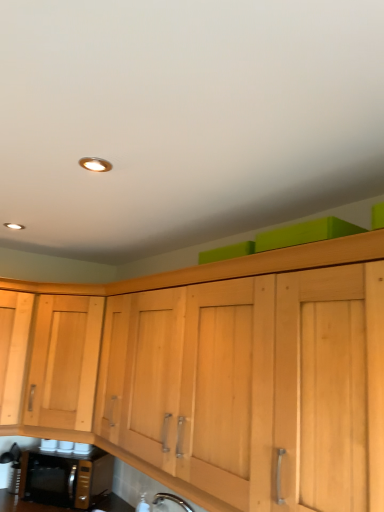
Question: From the image's perspective, is light wood cabinet at left above black metallic microwave oven at lower left?

Choices:
 (A) yes
 (B) no

Answer: (A)

Question: Does light wood cabinet at left appear on the right side of black metallic microwave oven at lower left?

Choices:
 (A) no
 (B) yes

Answer: (B)

Question: Could you tell me if light wood cabinet at left is turned towards black metallic microwave oven at lower left?

Choices:
 (A) no
 (B) yes

Answer: (A)

Question: Can you confirm if light wood cabinet at left is smaller than black metallic microwave oven at lower left?

Choices:
 (A) yes
 (B) no

Answer: (B)

Question: Is light wood cabinet at left shorter than black metallic microwave oven at lower left?

Choices:
 (A) yes
 (B) no

Answer: (B)

Question: Is light wood cabinet at left not inside black metallic microwave oven at lower left?

Choices:
 (A) yes
 (B) no

Answer: (A)

Question: Considering the relative sizes of black metallic microwave oven at lower left and light wood cabinet at left in the image provided, is black metallic microwave oven at lower left smaller than light wood cabinet at left?

Choices:
 (A) yes
 (B) no

Answer: (A)

Question: Can we say black metallic microwave oven at lower left lies outside light wood cabinet at left?

Choices:
 (A) no
 (B) yes

Answer: (B)

Question: Could you tell me if black metallic microwave oven at lower left is facing light wood cabinet at left?

Choices:
 (A) no
 (B) yes

Answer: (A)

Question: Is black metallic microwave oven at lower left in contact with light wood cabinet at left?

Choices:
 (A) no
 (B) yes

Answer: (A)

Question: From the image's perspective, is black metallic microwave oven at lower left above light wood cabinet at left?

Choices:
 (A) yes
 (B) no

Answer: (B)

Question: Does black metallic microwave oven at lower left have a larger size compared to light wood cabinet at left?

Choices:
 (A) yes
 (B) no

Answer: (B)

Question: Choose the correct answer: Is light wood cabinet at left inside black metallic microwave oven at lower left or outside it?

Choices:
 (A) outside
 (B) inside

Answer: (A)